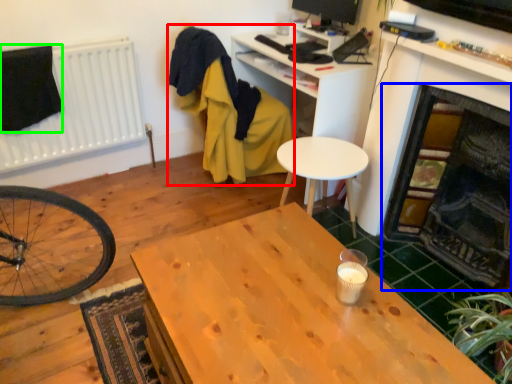
Question: Which object is positioned farthest from swivel chair (highlighted by a red box)? Select from fireplace (highlighted by a blue box) and clothe (highlighted by a green box).

Choices:
 (A) fireplace
 (B) clothe

Answer: (A)